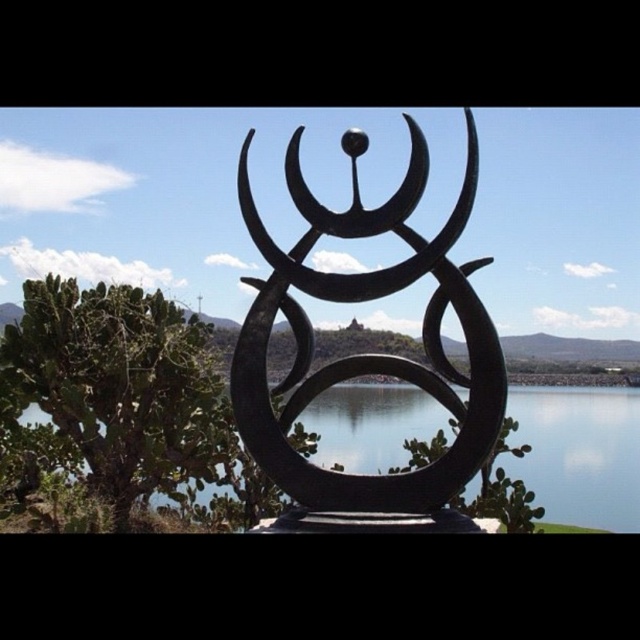
You are an artist planning to create a miniature version of this scene. You need to ensure that the black matte sculpture at center maintains the same proportional relationship with the transparent glass water at center as in the original image. Given that the sculpture in your model is 5 cm wide, what should be the minimum width of the water in your model to maintain the correct proportion?

The black matte sculpture at center has a lesser width compared to transparent glass water at center. Since the sculpture is 5 cm wide in the model, the water must be wider than 5 cm to maintain the proportional relationship.

You are standing in front of the sculpture and want to take a photo of both the black matte sculpture at center and the transparent glass water at center. To ensure both are in frame, should you pan your camera to the left or right?

Since the black matte sculpture at center is to the left of transparent glass water at center, you should pan your camera to the right to include both in the frame.

You are an artist analyzing the composition of the scene. Based on the sizes of the black matte sculpture at center and the transparent glass water at center, which one occupies a larger area in the image?

The transparent glass water at center occupies a larger area in the image because the black matte sculpture at center has a smaller size compared to it.